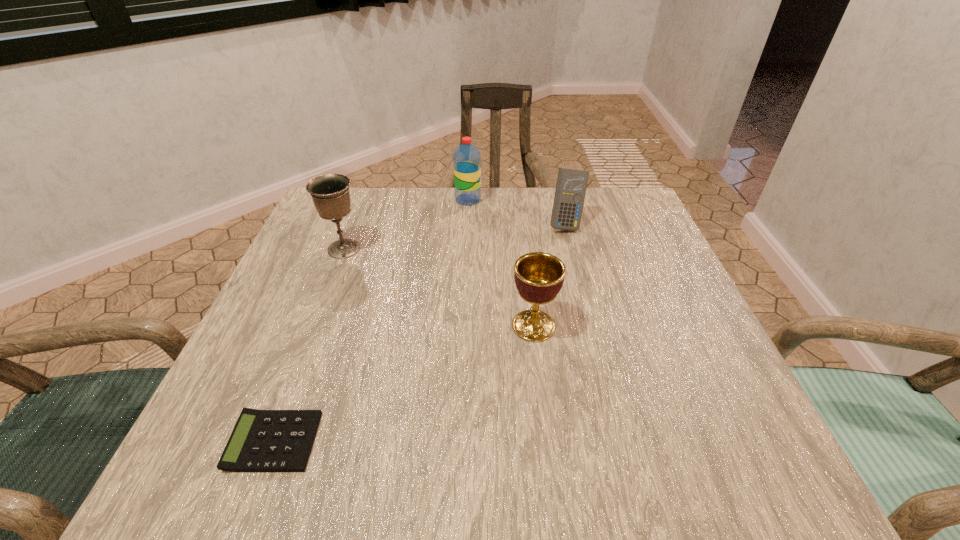
At what (x,y) coordinates should I click in order to perform the action: click on calculator that is at the left edge. Please return your answer as a coordinate pair (x, y). The width and height of the screenshot is (960, 540). Looking at the image, I should click on (262, 440).

The width and height of the screenshot is (960, 540). I want to click on object positioned at the right edge, so click(571, 186).

Where is `object at the far left corner`? This screenshot has width=960, height=540. object at the far left corner is located at coordinates (330, 193).

Image resolution: width=960 pixels, height=540 pixels. What are the coordinates of `object that is at the near left corner` in the screenshot? It's located at (262, 440).

This screenshot has width=960, height=540. I want to click on object located at the far right corner, so click(x=571, y=186).

You are a GUI agent. You are given a task and a screenshot of the screen. Output one action in this format:
    pyautogui.click(x=<x>, y=<y>)
    Task: Click on the vacant space at the far edge
    The height and width of the screenshot is (540, 960).
    Given the screenshot: What is the action you would take?
    pyautogui.click(x=500, y=220)

At what (x,y) coordinates should I click in order to perform the action: click on vacant space at the near edge of the desktop. Please return your answer as a coordinate pair (x, y). The image size is (960, 540). Looking at the image, I should click on (535, 462).

At what (x,y) coordinates should I click in order to perform the action: click on blank space at the left edge. Please return your answer as a coordinate pair (x, y). This screenshot has width=960, height=540. Looking at the image, I should click on (327, 298).

Locate an element on the screen. vacant point at the right edge is located at coordinates (643, 243).

The height and width of the screenshot is (540, 960). I want to click on vacant area at the far left corner, so click(x=357, y=200).